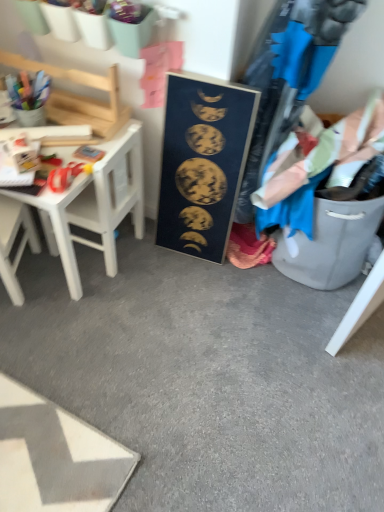
What are the coordinates of `blue cotton shirt at right` in the screenshot? It's located at (323, 169).

From the picture: Measure the distance between point (110, 157) and camera.

They are 4.44 feet apart.

Identify the location of white plastic chair at left. (13, 243).

Identify the location of blue cotton shirt at right. (323, 169).

Can you confirm if white wood table at left is thinner than blue cotton shirt at right?

Yes.

I want to click on clothing above the white wood table at left (from the image's perspective), so click(323, 169).

Is white wood table at left positioned beyond the bounds of blue cotton shirt at right?

Yes.

Identify the location of chair lying on the left of gold metallic moon phases at center. (13, 243).

Looking at their sizes, would you say white plastic chair at left is wider or thinner than gold metallic moon phases at center?

white plastic chair at left is wider than gold metallic moon phases at center.

Is white plastic chair at left aimed at gold metallic moon phases at center?

No.

Is the surface of white plastic chair at left in direct contact with gold metallic moon phases at center?

No.

Is point (39, 195) farther from camera compared to point (193, 176)?

No, it is in front of (193, 176).

Is there a large distance between white wood table at left and gold metallic moon phases at center?

white wood table at left is near gold metallic moon phases at center, not far away.

Considering the relative sizes of white wood table at left and gold metallic moon phases at center in the image provided, is white wood table at left wider than gold metallic moon phases at center?

Indeed, white wood table at left has a greater width compared to gold metallic moon phases at center.

Based on the photo, from a real-world perspective, is white wood table at left on gold metallic moon phases at center?

No, from a real-world perspective, white wood table at left is not over gold metallic moon phases at center

Is blue cotton shirt at right touching white plastic chair at left?

No, blue cotton shirt at right is not making contact with white plastic chair at left.

Is white plastic chair at left a part of blue cotton shirt at right?

No, white plastic chair at left is not inside blue cotton shirt at right.

Considering the relative sizes of blue cotton shirt at right and white plastic chair at left in the image provided, is blue cotton shirt at right smaller than white plastic chair at left?

No, blue cotton shirt at right is not smaller than white plastic chair at left.

From the image's perspective, would you say blue cotton shirt at right is shown under white plastic chair at left?

Actually, blue cotton shirt at right appears above white plastic chair at left in the image.

Is white wood table at left oriented away from white plastic chair at left?

Yes, white plastic chair at left is at the back of white wood table at left.

In the image, there is a white wood table at left. Identify the location of chair below it (from the image's perspective). (13, 243).

Would you say white wood table at left is to the left or to the right of white plastic chair at left in the picture?

Clearly, white wood table at left is on the right of white plastic chair at left in the image.

Can you tell me how much white wood table at left and white plastic chair at left differ in facing direction?

They differ by 158 degrees in their facing directions.

Is white plastic chair at left oriented away from white wood table at left?

Yes, white plastic chair at left is facing away from white wood table at left.

From the image's perspective, which is below, white plastic chair at left or white wood table at left?

white plastic chair at left appears lower in the image.

How different are the orientations of white plastic chair at left and white wood table at left in degrees?

white plastic chair at left and white wood table at left are facing 158 degrees away from each other.

How many degrees apart are the facing directions of blue cotton shirt at right and white wood table at left?

They differ by 0.0005 degrees in their facing directions.

Is point (345, 124) farther from viewer compared to point (94, 190)?

No, it is in front of (94, 190).

Could you tell me if blue cotton shirt at right is turned towards white wood table at left?

No, blue cotton shirt at right is not aimed at white wood table at left.

What are the coordinates of `clothing above the white wood table at left (from a real-world perspective)` in the screenshot? It's located at (323, 169).

I want to click on clothing that is in front of the white wood table at left, so click(x=323, y=169).

The image size is (384, 512). In order to click on bulletin board to the right of white plastic chair at left in this screenshot , I will do `click(202, 163)`.

From the image, which object appears to be farther from white wood table at left, white plastic chair at left or gold metallic moon phases at center?

Based on the image, gold metallic moon phases at center appears to be further to white wood table at left.

Considering their positions, is white wood table at left positioned closer to blue cotton shirt at right than gold metallic moon phases at center?

gold metallic moon phases at center lies closer to blue cotton shirt at right than the other object.

When comparing their distances from gold metallic moon phases at center, does white wood table at left or blue cotton shirt at right seem closer?

Among the two, blue cotton shirt at right is located nearer to gold metallic moon phases at center.

Considering their positions, is white plastic chair at left positioned further to blue cotton shirt at right than gold metallic moon phases at center?

Based on the image, white plastic chair at left appears to be further to blue cotton shirt at right.

From the image, which object appears to be nearer to white wood table at left, white plastic chair at left or blue cotton shirt at right?

white plastic chair at left is closer to white wood table at left.

Looking at the image, which one is located further to white plastic chair at left, gold metallic moon phases at center or blue cotton shirt at right?

The object further to white plastic chair at left is blue cotton shirt at right.

From the image, which object appears to be nearer to white plastic chair at left, gold metallic moon phases at center or white wood table at left?

white wood table at left is positioned closer to the anchor white plastic chair at left.

Looking at the image, which one is located further to gold metallic moon phases at center, white plastic chair at left or white wood table at left?

Based on the image, white plastic chair at left appears to be further to gold metallic moon phases at center.

What are the coordinates of `table between white plastic chair at left and gold metallic moon phases at center` in the screenshot? It's located at (94, 205).

Where is `bulletin board located between white plastic chair at left and blue cotton shirt at right in the left-right direction`? This screenshot has width=384, height=512. bulletin board located between white plastic chair at left and blue cotton shirt at right in the left-right direction is located at coordinates (202, 163).

Where is `table located between white plastic chair at left and blue cotton shirt at right in the left-right direction`? table located between white plastic chair at left and blue cotton shirt at right in the left-right direction is located at coordinates (94, 205).

Identify the location of bulletin board located between white wood table at left and blue cotton shirt at right in the left-right direction. This screenshot has height=512, width=384. (202, 163).